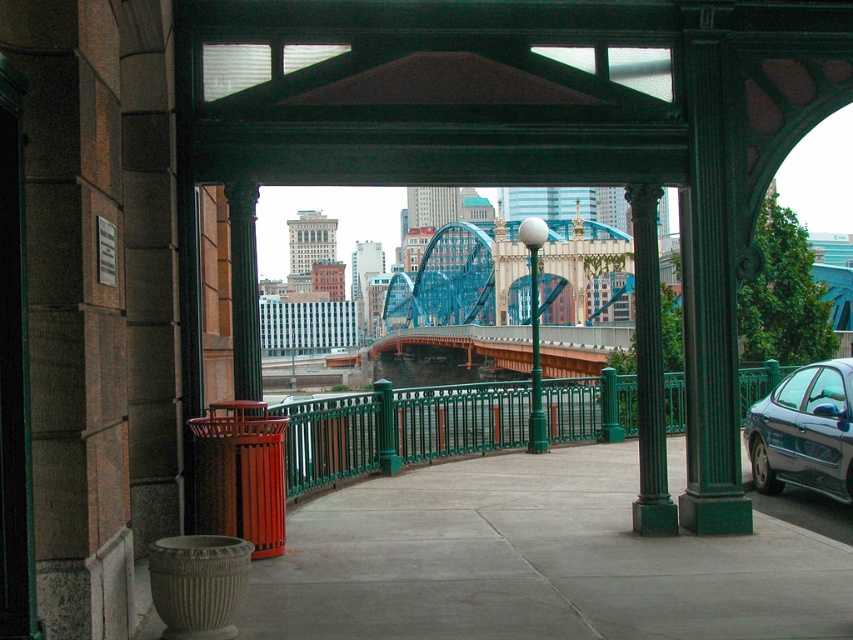
You are standing on the gray concrete pavement at lower left and want to see the shiny dark gray sedan at right. Can you see the entire sedan from your current position?

The gray concrete pavement at lower left is not as tall as shiny dark gray sedan at right, so yes, you can see the entire sedan from your current position because the pavement is lower than the sedan.

You are a delivery robot on the gray concrete pavement at lower left and need to move to the green metal fence at center. Can you fit through the space between them if the robot is 1 meter wide?

The gray concrete pavement at lower left is thinner than the green metal fence at center. Since the pavement is thinner, the available space between them might be narrower than the fence. However, without exact measurements, it is uncertain if the robot can fit through. The robot should check the actual width before proceeding.